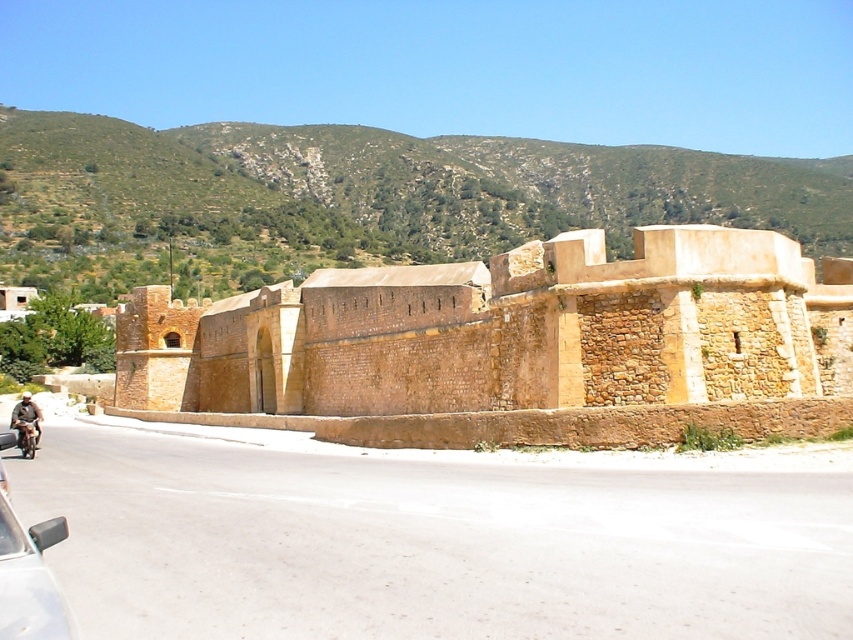
Which is behind, point (38, 442) or point (33, 440)?

The point (38, 442) is behind.

What are the coordinates of `brown leather jacket at lower left` in the screenshot? It's located at (26, 419).

Identify the location of brown leather jacket at lower left. This screenshot has width=853, height=640. (26, 419).

Which is in front, point (354, 182) or point (33, 422)?

Point (33, 422) is more forward.

At what (x,y) coordinates should I click in order to perform the action: click on green textured hillside at upper center. Please return your answer as a coordinate pair (x, y). The height and width of the screenshot is (640, 853). Looking at the image, I should click on (366, 195).

Between point (202, 252) and point (26, 392), which one is positioned behind?

Positioned behind is point (202, 252).

This screenshot has height=640, width=853. In order to click on green textured hillside at upper center in this screenshot , I will do `click(366, 195)`.

Measure the distance between point (39,595) and camera.

Point (39,595) and camera are 65.56 feet apart.

Between silver metallic car at lower left and brown leather jacket at lower left, which one is positioned higher?

silver metallic car at lower left is above.

Image resolution: width=853 pixels, height=640 pixels. What are the coordinates of `silver metallic car at lower left` in the screenshot? It's located at (30, 579).

Identify the location of silver metallic car at lower left. Image resolution: width=853 pixels, height=640 pixels. (30, 579).